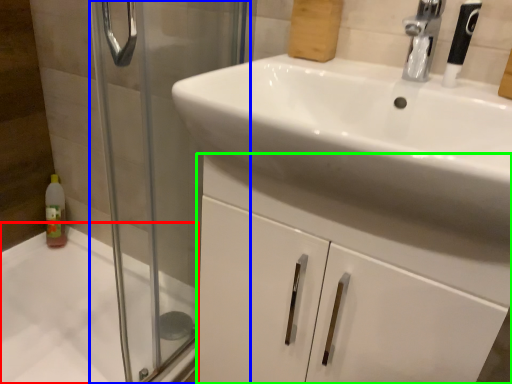
Question: Which is farther away from bath (highlighted by a red box)? screen door (highlighted by a blue box) or bathroom cabinet (highlighted by a green box)?

Choices:
 (A) screen door
 (B) bathroom cabinet

Answer: (B)